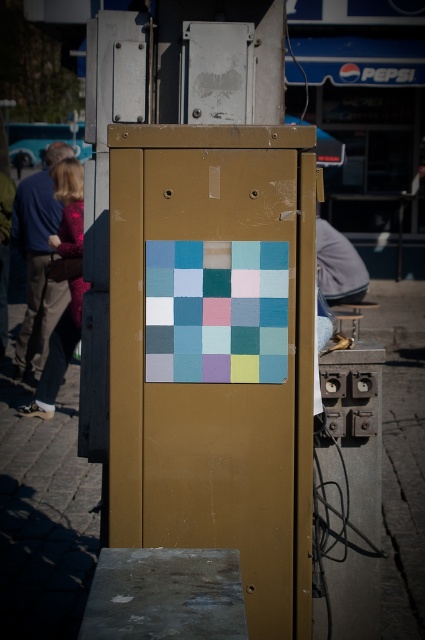
Who is higher up, gold metallic phone box at center or wooden stool at right?

wooden stool at right is above.

Does gold metallic phone box at center appear over wooden stool at right?

Actually, gold metallic phone box at center is below wooden stool at right.

Which is behind, point (178, 152) or point (342, 317)?

The point (342, 317) is behind.

Where is `gold metallic phone box at center`? The width and height of the screenshot is (425, 640). gold metallic phone box at center is located at coordinates (215, 353).

Can you confirm if matte concrete pavement at center is thinner than gray fabric at right?

Correct, matte concrete pavement at center's width is less than gray fabric at right's.

Does point (0, 595) come closer to viewer compared to point (365, 275)?

Yes.

Measure the distance between matte concrete pavement at center and camera.

A distance of 5.01 meters exists between matte concrete pavement at center and camera.

You are a GUI agent. You are given a task and a screenshot of the screen. Output one action in this format:
    pyautogui.click(x=<x>, y=<y>)
    Task: Click on the matte concrete pavement at center
    
    Given the screenshot: What is the action you would take?
    pyautogui.click(x=45, y=516)

From the picture: Which of these two, wooden stool at center or wooden stool at right, stands shorter?

wooden stool at right is shorter.

Between point (368, 307) and point (339, 328), which one is positioned in front?

Positioned in front is point (339, 328).

Is point (339, 323) positioned behind point (337, 330)?

Yes.

Find the location of `wooden stool at center`. wooden stool at center is located at coordinates (353, 314).